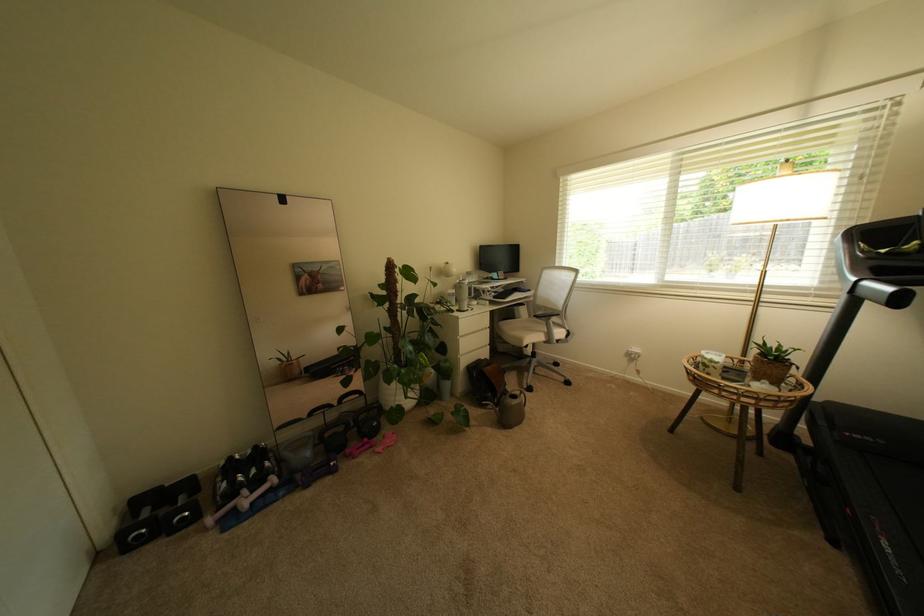
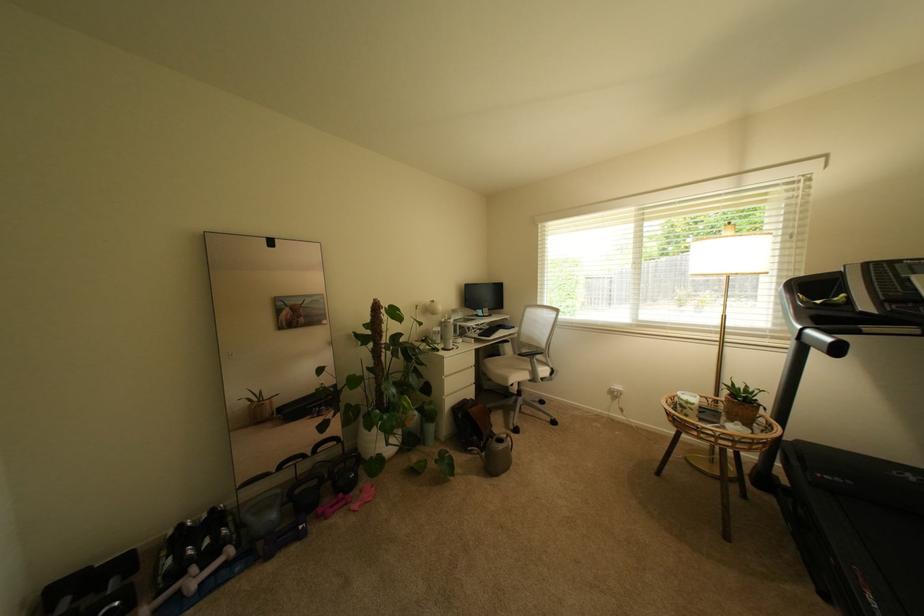
The point at (366, 450) is marked in the first image. Where is the corresponding point in the second image?

(339, 508)